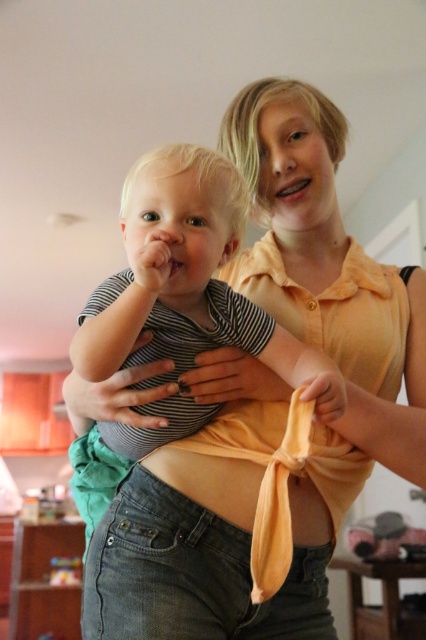
Question: Which point is closer to the camera?

Choices:
 (A) (204, 464)
 (B) (196, 172)

Answer: (B)

Question: Can you confirm if striped fabric shirt at center is bigger than orange fabric at center?

Choices:
 (A) no
 (B) yes

Answer: (B)

Question: Which point is farther to the camera?

Choices:
 (A) striped fabric shirt at center
 (B) orange fabric at center

Answer: (B)

Question: Which of the following is the farthest from the observer?

Choices:
 (A) striped fabric shirt at center
 (B) orange fabric at center

Answer: (B)

Question: Does striped fabric shirt at center appear over orange fabric at center?

Choices:
 (A) no
 (B) yes

Answer: (B)

Question: Is striped fabric shirt at center in front of orange fabric at center?

Choices:
 (A) no
 (B) yes

Answer: (B)